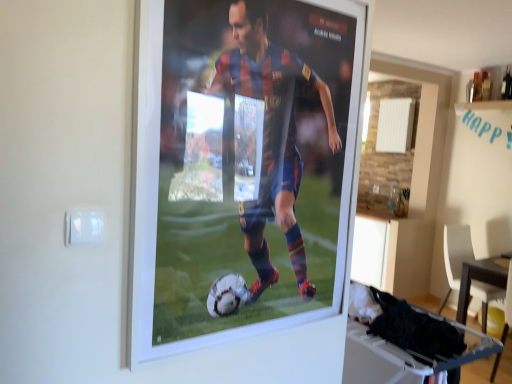
Question: From the image's perspective, would you say white plastic table at lower right, placed as the second table when sorted from right to left, is shown under wooden table at lower right, the second table from the left?

Choices:
 (A) no
 (B) yes

Answer: (A)

Question: Is white plastic table at lower right, placed as the 2th table when sorted from back to front, turned away from wooden table at lower right, the second table positioned from the front?

Choices:
 (A) no
 (B) yes

Answer: (A)

Question: Is white plastic table at lower right, placed as the 1th table when sorted from top to bottom, bigger than wooden table at lower right, arranged as the 1th table when viewed from the right?

Choices:
 (A) yes
 (B) no

Answer: (B)

Question: Is white plastic table at lower right, which ranks as the 1th table in front-to-back order, wider than wooden table at lower right, the second table positioned from the front?

Choices:
 (A) no
 (B) yes

Answer: (A)

Question: Is white plastic table at lower right, placed as the 2th table when sorted from back to front, outside wooden table at lower right, arranged as the first table when viewed from the back?

Choices:
 (A) yes
 (B) no

Answer: (A)

Question: Does white plastic chair at lower right have a lesser height compared to white plastic table at lower right, placed as the 2th table when sorted from back to front?

Choices:
 (A) yes
 (B) no

Answer: (B)

Question: Does white plastic chair at lower right appear on the right side of white plastic table at lower right, placed as the 1th table when sorted from top to bottom?

Choices:
 (A) yes
 (B) no

Answer: (A)

Question: Considering the relative sizes of white plastic chair at lower right and white plastic table at lower right, placed as the 1th table when sorted from top to bottom, in the image provided, is white plastic chair at lower right bigger than white plastic table at lower right, placed as the 1th table when sorted from top to bottom,?

Choices:
 (A) yes
 (B) no

Answer: (A)

Question: Is white plastic table at lower right, placed as the 2th table when sorted from back to front, completely or partially inside white plastic chair at lower right?

Choices:
 (A) yes
 (B) no

Answer: (B)

Question: From a real-world perspective, is white plastic chair at lower right below white plastic table at lower right, which ranks as the 1th table in front-to-back order?

Choices:
 (A) no
 (B) yes

Answer: (B)

Question: Considering the relative sizes of white plastic chair at lower right and white plastic table at lower right, placed as the 2th table when sorted from back to front, in the image provided, is white plastic chair at lower right wider than white plastic table at lower right, placed as the 2th table when sorted from back to front,?

Choices:
 (A) yes
 (B) no

Answer: (A)

Question: Does white plastic table at lower right, the 2th table when ordered from bottom to top, have a larger size compared to white plastic chair at lower right?

Choices:
 (A) yes
 (B) no

Answer: (B)